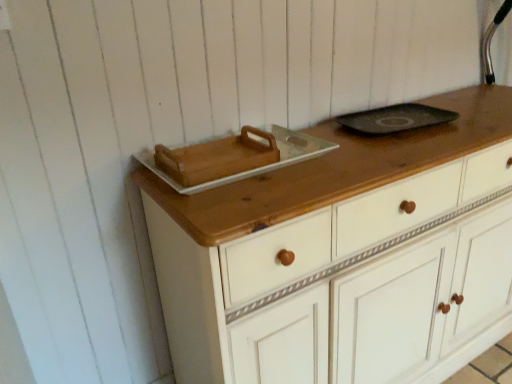
Question: From the image's perspective, relative to wooden tray at upper center, is white painted wood chest of drawers at center above or below?

Choices:
 (A) below
 (B) above

Answer: (A)

Question: In the image, is white painted wood chest of drawers at center positioned in front of or behind wooden tray at upper center?

Choices:
 (A) behind
 (B) front

Answer: (B)

Question: Is white painted wood chest of drawers at center inside or outside of wooden tray at upper center?

Choices:
 (A) inside
 (B) outside

Answer: (B)

Question: Which is correct: wooden tray at upper center is inside white painted wood chest of drawers at center, or outside of it?

Choices:
 (A) inside
 (B) outside

Answer: (B)

Question: Considering the relative positions of wooden tray at upper center and white painted wood chest of drawers at center in the image provided, is wooden tray at upper center to the left or to the right of white painted wood chest of drawers at center?

Choices:
 (A) left
 (B) right

Answer: (A)

Question: From a real-world perspective, is wooden tray at upper center above or below white painted wood chest of drawers at center?

Choices:
 (A) below
 (B) above

Answer: (B)

Question: In the image, is wooden tray at upper center positioned in front of or behind white painted wood chest of drawers at center?

Choices:
 (A) behind
 (B) front

Answer: (A)